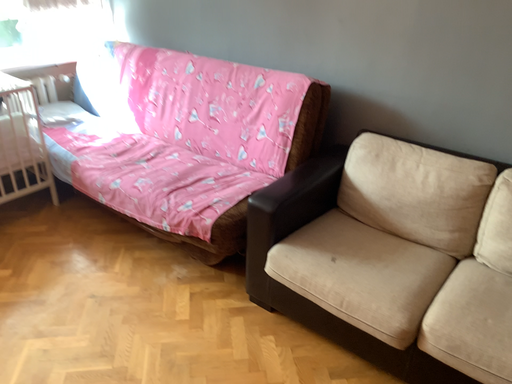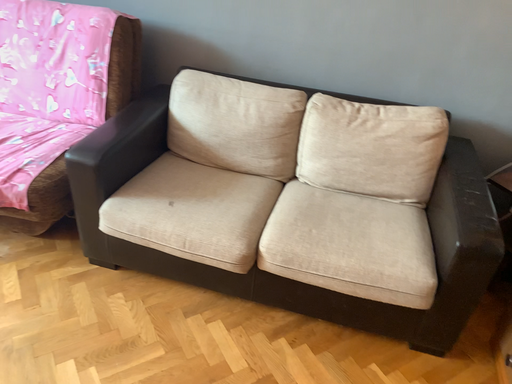
Question: Which way did the camera rotate in the video?

Choices:
 (A) rotated left
 (B) rotated right

Answer: (B)